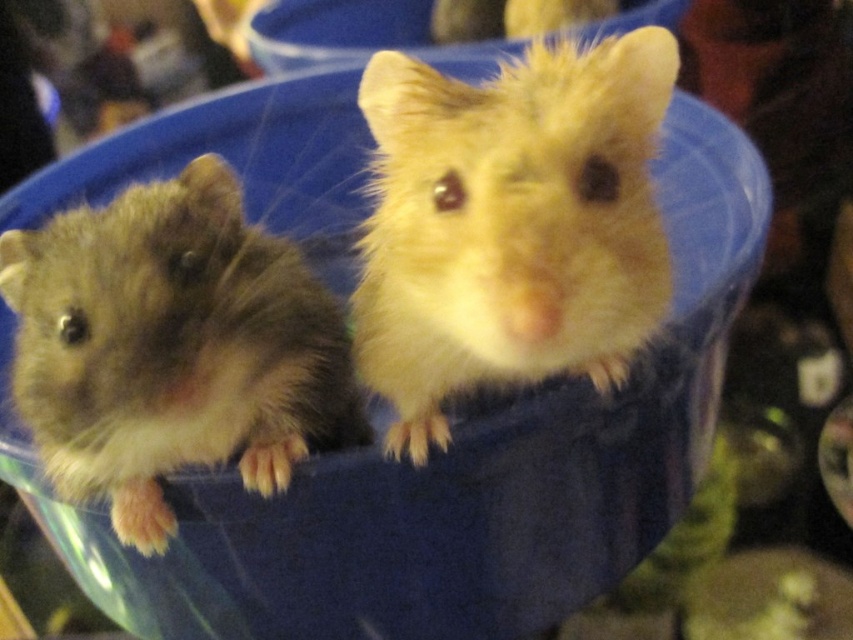
Is point (582, 259) less distant than point (24, 369)?

Yes.

Find the location of a particular element. This screenshot has width=853, height=640. fluffy golden hamster at center is located at coordinates (509, 225).

Is point (502, 106) farther from viewer compared to point (33, 262)?

No.

Find the location of a particular element. This screenshot has width=853, height=640. fluffy golden hamster at center is located at coordinates (509, 225).